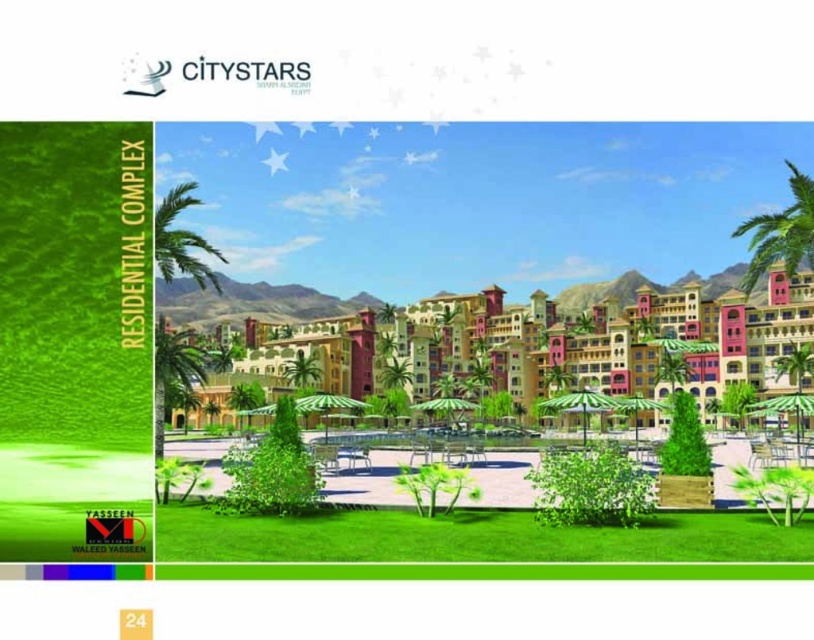
Is green grass at center wider than green leafy palm tree at right?

In fact, green grass at center might be narrower than green leafy palm tree at right.

Is point (318, 541) in front of point (801, 208)?

Yes, it is.

Does point (690, 548) come closer to viewer compared to point (751, 232)?

Yes, it is in front of point (751, 232).

Where is `green grass at center`? The width and height of the screenshot is (814, 640). green grass at center is located at coordinates (466, 529).

Which of these two, green grass at center or green leafy palm tree at center, stands taller?

green leafy palm tree at center is taller.

Which is in front, point (476, 541) or point (795, 358)?

Positioned in front is point (476, 541).

At what (x,y) coordinates should I click in order to perform the action: click on green grass at center. Please return your answer as a coordinate pair (x, y). Looking at the image, I should click on (466, 529).

Between multicolored stucco buildings at center and green grass at center, which one has more height?

Standing taller between the two is multicolored stucco buildings at center.

Based on the photo, measure the distance between multicolored stucco buildings at center and camera.

86.76 meters

Identify the location of multicolored stucco buildings at center. (611, 340).